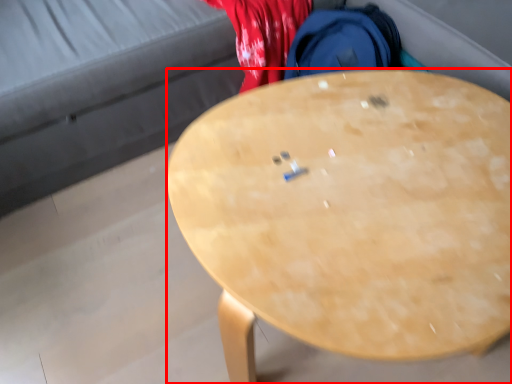
Question: In this image, where is desk (annotated by the red box) located relative to studio couch?

Choices:
 (A) right
 (B) left

Answer: (A)